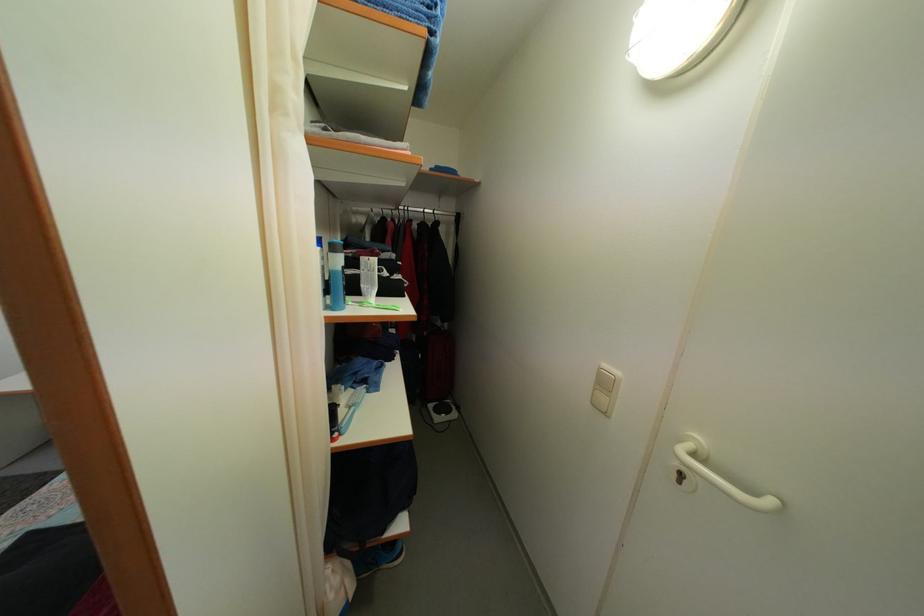
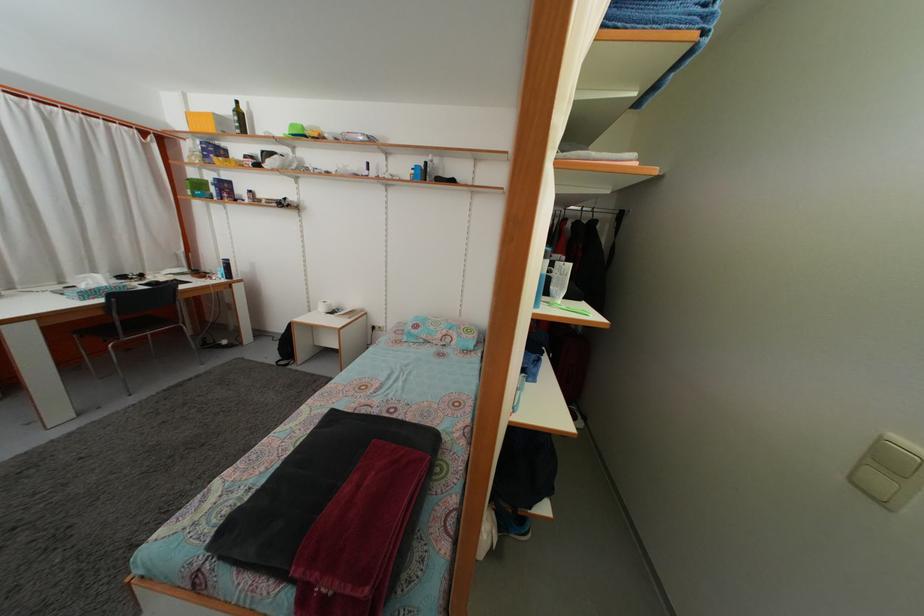
In the second image, find the point that corresponds to pixel 371 277 in the first image.

(564, 282)